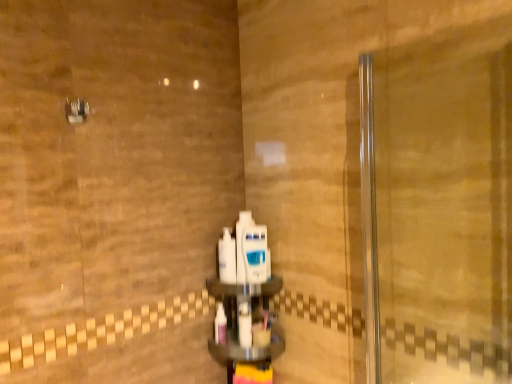
In order to click on white glossy mouthwash at center, arranged as the 3th mouthwash when ordered from the bottom in this screenshot , I will do (255, 254).

What do you see at coordinates (76, 111) in the screenshot?
I see `metallic silver showerhead at upper left` at bounding box center [76, 111].

What is the approximate height of metallic silver showerhead at upper left?

metallic silver showerhead at upper left is 6.74 centimeters tall.

How much space does white glossy mouthwash at center, arranged as the 2th mouthwash when ordered from the bottom, occupy vertically?

white glossy mouthwash at center, arranged as the 2th mouthwash when ordered from the bottom, is 20.04 centimeters tall.

Identify the location of white glossy mouthwash at center, positioned as the second mouthwash in top-to-bottom order. Image resolution: width=512 pixels, height=384 pixels. (255, 254).

Is point (70, 110) positioned in front of point (214, 326)?

Yes, point (70, 110) is in front of point (214, 326).

From the picture: Which is correct: metallic silver showerhead at upper left is inside white plastic toothbrush at center, or outside of it?

metallic silver showerhead at upper left lies outside white plastic toothbrush at center.

Between metallic silver showerhead at upper left and white plastic toothbrush at center, which one appears on the right side from the viewer's perspective?

white plastic toothbrush at center.

Which object is thinner, metallic silver showerhead at upper left or white plastic toothbrush at center?

white plastic toothbrush at center.

Is white glossy mouthwash at center, arranged as the 3th mouthwash when ordered from the bottom, touching white glossy mouthwash at center, arranged as the first mouthwash when viewed from the top?

Yes, white glossy mouthwash at center, arranged as the 3th mouthwash when ordered from the bottom, is with white glossy mouthwash at center, arranged as the first mouthwash when viewed from the top.

How many degrees apart are the facing directions of white glossy mouthwash at center, arranged as the 3th mouthwash when ordered from the bottom, and white glossy mouthwash at center, arranged as the first mouthwash when viewed from the top?

The facing directions of white glossy mouthwash at center, arranged as the 3th mouthwash when ordered from the bottom, and white glossy mouthwash at center, arranged as the first mouthwash when viewed from the top, are 0.532 degrees apart.

Based on the photo, which of these two, white glossy mouthwash at center, positioned as the second mouthwash in top-to-bottom order, or white glossy mouthwash at center, which is the fourth mouthwash from bottom to top, is smaller?

white glossy mouthwash at center, positioned as the second mouthwash in top-to-bottom order, is smaller.

From the image's perspective, does white glossy mouthwash at center, arranged as the 3th mouthwash when ordered from the bottom, appear lower than white glossy mouthwash at center, arranged as the first mouthwash when viewed from the top?

→ Yes, from the image's perspective, white glossy mouthwash at center, arranged as the 3th mouthwash when ordered from the bottom, is beneath white glossy mouthwash at center, arranged as the first mouthwash when viewed from the top.

Can you confirm if clear glass screen door at right is bigger than white plastic mouthwash at center, positioned as the 4th mouthwash in top-to-bottom order?

Yes, clear glass screen door at right is bigger than white plastic mouthwash at center, positioned as the 4th mouthwash in top-to-bottom order.

Between clear glass screen door at right and white plastic mouthwash at center, positioned as the 4th mouthwash in top-to-bottom order, which one appears on the right side from the viewer's perspective?

clear glass screen door at right.

From a real-world perspective, count 4th mouthwashs downward from the clear glass screen door at right and point to it. Please provide its 2D coordinates.

[(244, 325)]

From a real-world perspective, which is physically below, white glossy mouthwash at center, which is the fourth mouthwash from bottom to top, or white glossy mouthwash at center, the third mouthwash in the top-to-bottom sequence?

white glossy mouthwash at center, the third mouthwash in the top-to-bottom sequence.

Is white glossy mouthwash at center, which is the fourth mouthwash from bottom to top, to the left or to the right of white glossy mouthwash at center, arranged as the 2th mouthwash when ordered from the bottom, in the image?

Based on their positions, white glossy mouthwash at center, which is the fourth mouthwash from bottom to top, is located to the right of white glossy mouthwash at center, arranged as the 2th mouthwash when ordered from the bottom.

Is white glossy mouthwash at center, positioned as the second mouthwash in top-to-bottom order, at the left side of white plastic mouthwash at center, which is counted as the 1th mouthwash, starting from the bottom?

In fact, white glossy mouthwash at center, positioned as the second mouthwash in top-to-bottom order, is to the right of white plastic mouthwash at center, which is counted as the 1th mouthwash, starting from the bottom.

In terms of size, does white glossy mouthwash at center, arranged as the 3th mouthwash when ordered from the bottom, appear bigger or smaller than white plastic mouthwash at center, which is counted as the 1th mouthwash, starting from the bottom?

Clearly, white glossy mouthwash at center, arranged as the 3th mouthwash when ordered from the bottom, is larger in size than white plastic mouthwash at center, which is counted as the 1th mouthwash, starting from the bottom.

Consider the image. Is white glossy mouthwash at center, arranged as the 3th mouthwash when ordered from the bottom, beside white plastic mouthwash at center, positioned as the 4th mouthwash in top-to-bottom order?

No, white glossy mouthwash at center, arranged as the 3th mouthwash when ordered from the bottom, is not in contact with white plastic mouthwash at center, positioned as the 4th mouthwash in top-to-bottom order.

Does point (73, 120) come in front of point (243, 331)?

Yes, point (73, 120) is in front of point (243, 331).

Does metallic silver showerhead at upper left have a greater width compared to white plastic mouthwash at center, which is counted as the 1th mouthwash, starting from the bottom?

Indeed, metallic silver showerhead at upper left has a greater width compared to white plastic mouthwash at center, which is counted as the 1th mouthwash, starting from the bottom.

From the image's perspective, which object appears higher, metallic silver showerhead at upper left or white plastic mouthwash at center, positioned as the 4th mouthwash in top-to-bottom order?

metallic silver showerhead at upper left, from the image's perspective.

What's the angular difference between metallic silver showerhead at upper left and white plastic mouthwash at center, positioned as the 4th mouthwash in top-to-bottom order,'s facing directions?

1.21 degrees separate the facing orientations of metallic silver showerhead at upper left and white plastic mouthwash at center, positioned as the 4th mouthwash in top-to-bottom order.

From the image's perspective, between metallic silver showerhead at upper left and white glossy mouthwash at center, which is the fourth mouthwash from bottom to top, which one is located above?

metallic silver showerhead at upper left.

Measure the distance between metallic silver showerhead at upper left and white glossy mouthwash at center, which is the fourth mouthwash from bottom to top.

metallic silver showerhead at upper left is 24.47 inches from white glossy mouthwash at center, which is the fourth mouthwash from bottom to top.

Find the location of a particular element. shower lying in front of the white glossy mouthwash at center, which is the fourth mouthwash from bottom to top is located at coordinates (76, 111).

Based on the photo, which of these two, metallic silver showerhead at upper left or white glossy mouthwash at center, arranged as the first mouthwash when viewed from the top, is bigger?

white glossy mouthwash at center, arranged as the first mouthwash when viewed from the top.

Find the location of a particular element. The image size is (512, 384). toothbrush below the metallic silver showerhead at upper left (from a real-world perspective) is located at coordinates (220, 325).

Which mouthwash is the 1st one when counting from the left side of the white glossy mouthwash at center, positioned as the second mouthwash in top-to-bottom order? Please provide its 2D coordinates.

[(242, 244)]

Looking at the image, which one is located closer to white glossy mouthwash at center, arranged as the 2th mouthwash when ordered from the bottom, clear glass screen door at right or metallic silver showerhead at upper left?

The object closer to white glossy mouthwash at center, arranged as the 2th mouthwash when ordered from the bottom, is metallic silver showerhead at upper left.

Based on their spatial positions, is white plastic mouthwash at center, which is counted as the 1th mouthwash, starting from the bottom, or metallic silver showerhead at upper left closer to white plastic toothbrush at center?

white plastic mouthwash at center, which is counted as the 1th mouthwash, starting from the bottom, is closer to white plastic toothbrush at center.

Looking at the image, which one is located closer to white plastic mouthwash at center, positioned as the 4th mouthwash in top-to-bottom order, clear glass screen door at right or white glossy mouthwash at center, arranged as the first mouthwash when viewed from the top?

white glossy mouthwash at center, arranged as the first mouthwash when viewed from the top, is positioned closer to the anchor white plastic mouthwash at center, positioned as the 4th mouthwash in top-to-bottom order.

Estimate the real-world distances between objects in this image. Which object is closer to white plastic mouthwash at center, positioned as the 4th mouthwash in top-to-bottom order, white plastic toothbrush at center or white glossy mouthwash at center, arranged as the first mouthwash when viewed from the top?

white plastic toothbrush at center lies closer to white plastic mouthwash at center, positioned as the 4th mouthwash in top-to-bottom order, than the other object.

From the image, which object appears to be nearer to white glossy mouthwash at center, arranged as the first mouthwash when viewed from the top, white plastic toothbrush at center or white glossy mouthwash at center, the third mouthwash in the top-to-bottom sequence?

white glossy mouthwash at center, the third mouthwash in the top-to-bottom sequence, is closer to white glossy mouthwash at center, arranged as the first mouthwash when viewed from the top.

From the image, which object appears to be farther from white plastic mouthwash at center, positioned as the 4th mouthwash in top-to-bottom order, white glossy mouthwash at center, arranged as the 2th mouthwash when ordered from the bottom, or white glossy mouthwash at center, arranged as the first mouthwash when viewed from the top?

white glossy mouthwash at center, arranged as the first mouthwash when viewed from the top, is further to white plastic mouthwash at center, positioned as the 4th mouthwash in top-to-bottom order.

Based on their spatial positions, is white plastic mouthwash at center, positioned as the 4th mouthwash in top-to-bottom order, or white glossy mouthwash at center, arranged as the 3th mouthwash when ordered from the bottom, closer to white glossy mouthwash at center, arranged as the first mouthwash when viewed from the top?

white glossy mouthwash at center, arranged as the 3th mouthwash when ordered from the bottom, is closer to white glossy mouthwash at center, arranged as the first mouthwash when viewed from the top.

Which object lies further to the anchor point clear glass screen door at right, white plastic toothbrush at center or white glossy mouthwash at center, arranged as the 2th mouthwash when ordered from the bottom?

Among the two, white plastic toothbrush at center is located further to clear glass screen door at right.

Where is `toothbrush between metallic silver showerhead at upper left and clear glass screen door at right`? The height and width of the screenshot is (384, 512). toothbrush between metallic silver showerhead at upper left and clear glass screen door at right is located at coordinates [220, 325].

The image size is (512, 384). In order to click on mouthwash between clear glass screen door at right and white glossy mouthwash at center, the third mouthwash in the top-to-bottom sequence, from front to back in this screenshot , I will do (x=255, y=254).

The width and height of the screenshot is (512, 384). I want to click on mouthwash between white glossy mouthwash at center, arranged as the 2th mouthwash when ordered from the bottom, and white plastic toothbrush at center vertically, so click(244, 325).

You are a GUI agent. You are given a task and a screenshot of the screen. Output one action in this format:
    pyautogui.click(x=<x>, y=<y>)
    Task: Click on the mouthwash that lies between white glossy mouthwash at center, arranged as the 3th mouthwash when ordered from the bottom, and white plastic mouthwash at center, positioned as the 4th mouthwash in top-to-bottom order, from top to bottom
    Image resolution: width=512 pixels, height=384 pixels.
    Given the screenshot: What is the action you would take?
    pyautogui.click(x=227, y=257)